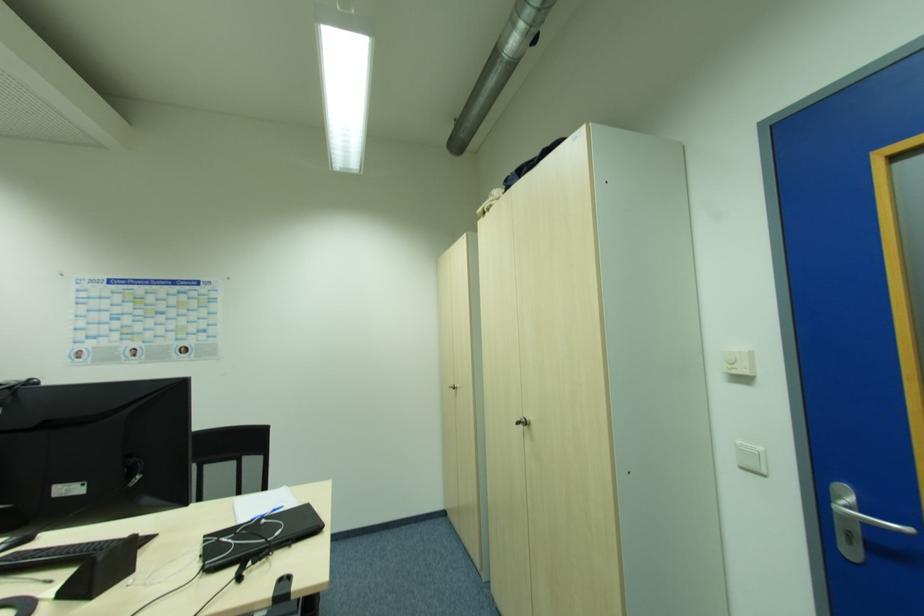
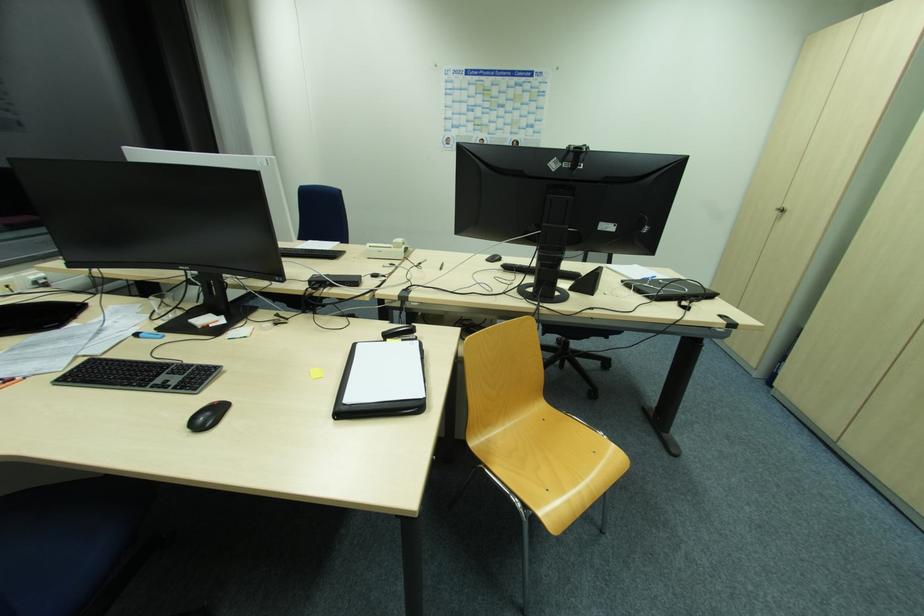
In the second image, find the point that corresponds to the point at 455,390 in the first image.

(779, 214)